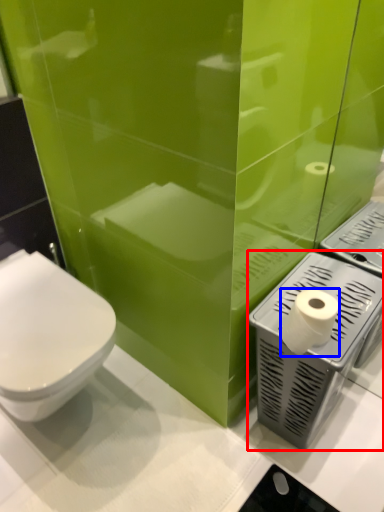
Question: Which object is further to the camera taking this photo, appliance (highlighted by a red box) or toilet paper (highlighted by a blue box)?

Choices:
 (A) appliance
 (B) toilet paper

Answer: (A)